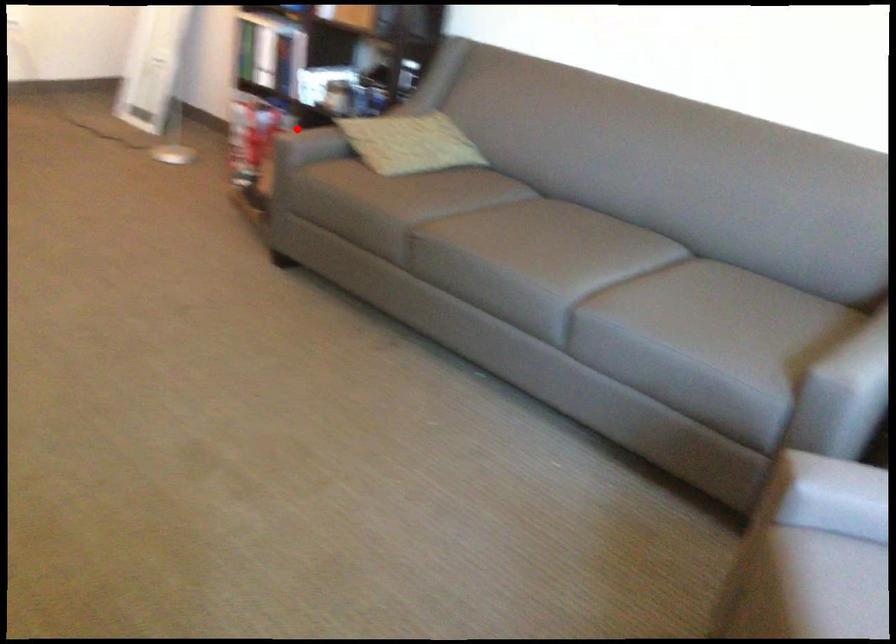
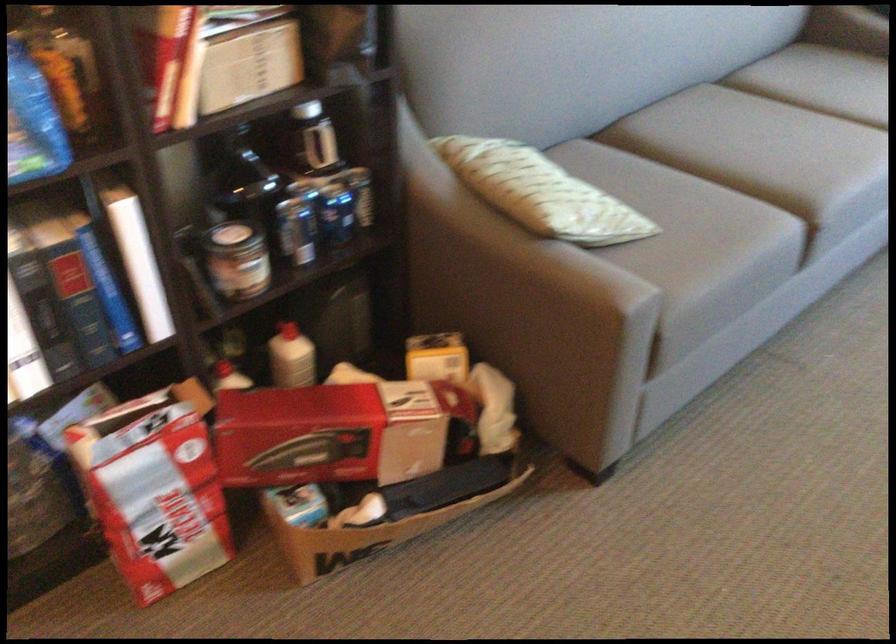
Locate, in the second image, the point that corresponds to the highlighted location in the first image.

(514, 281)